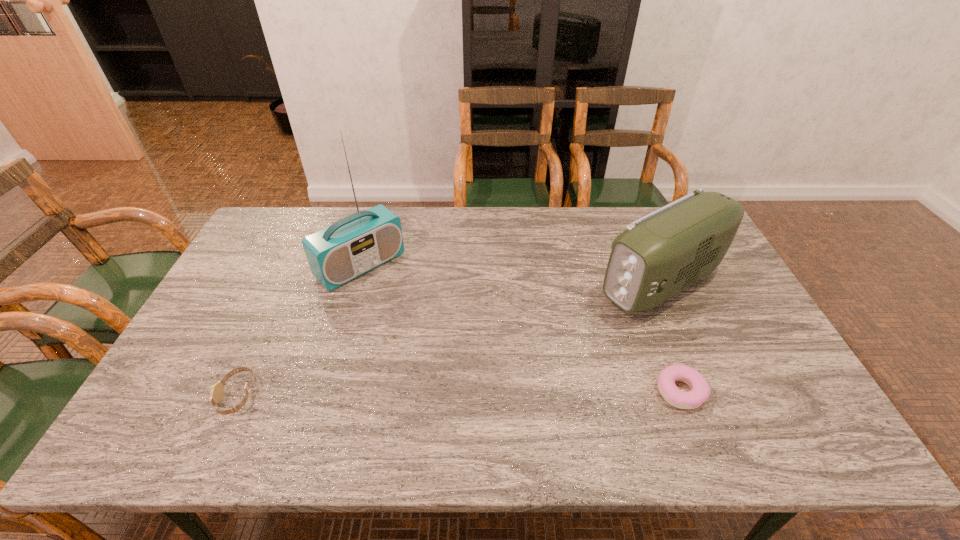
The height and width of the screenshot is (540, 960). In order to click on vacant space situated on the front-facing side of the shorter radio receiver in this screenshot , I will do `click(593, 317)`.

What are the coordinates of `vacant space located on the front-facing side of the shorter radio receiver` in the screenshot? It's located at (541, 347).

This screenshot has height=540, width=960. What are the coordinates of `free space located 0.370m on the front-facing side of the shorter radio receiver` in the screenshot? It's located at (512, 364).

You are a GUI agent. You are given a task and a screenshot of the screen. Output one action in this format:
    pyautogui.click(x=<x>, y=<y>)
    Task: Click on the free spot located 0.380m on the front panel of the second object from left to right
    The width and height of the screenshot is (960, 540).
    Given the screenshot: What is the action you would take?
    pyautogui.click(x=466, y=361)

Find the location of `vacant space located on the front panel of the second object from left to right`. vacant space located on the front panel of the second object from left to right is located at coordinates (418, 316).

This screenshot has height=540, width=960. I want to click on vacant region located 0.230m on the front panel of the second object from left to right, so click(430, 328).

Identify the location of watch at the near edge. This screenshot has width=960, height=540. (217, 390).

You are a GUI agent. You are given a task and a screenshot of the screen. Output one action in this format:
    pyautogui.click(x=<x>, y=<y>)
    Task: Click on the pastry present at the near edge
    
    Given the screenshot: What is the action you would take?
    [700, 391]

At what (x,y) coordinates should I click in order to perform the action: click on object at the left edge. Please return your answer as a coordinate pair (x, y). Looking at the image, I should click on (217, 390).

The height and width of the screenshot is (540, 960). Find the location of `object situated at the right edge`. object situated at the right edge is located at coordinates (660, 254).